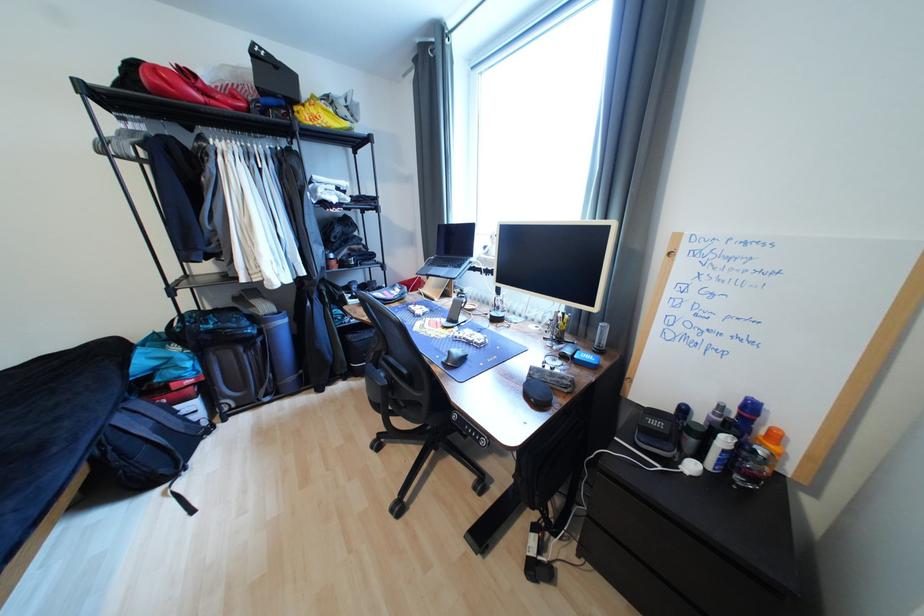
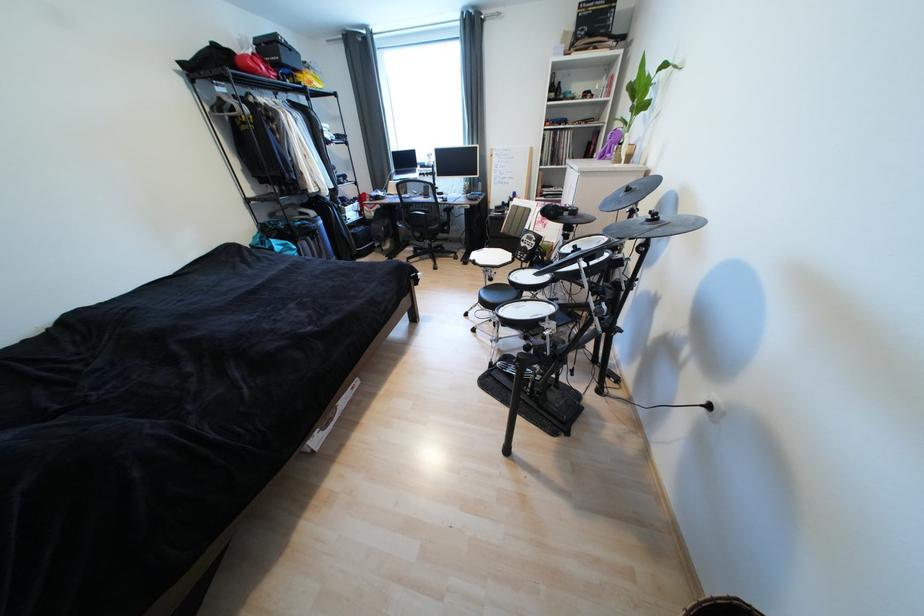
Locate, in the second image, the point that corresponds to [167,92] in the first image.

(261, 73)